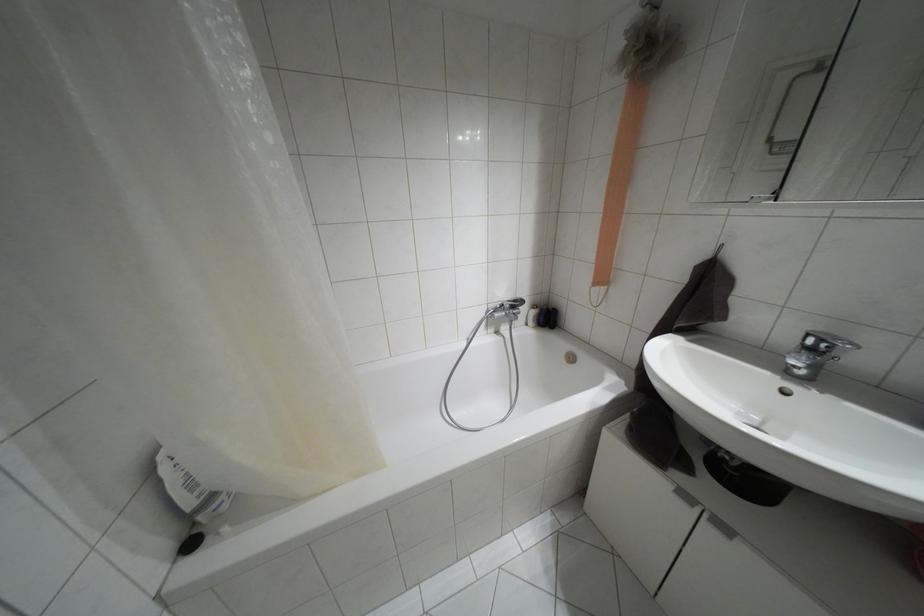
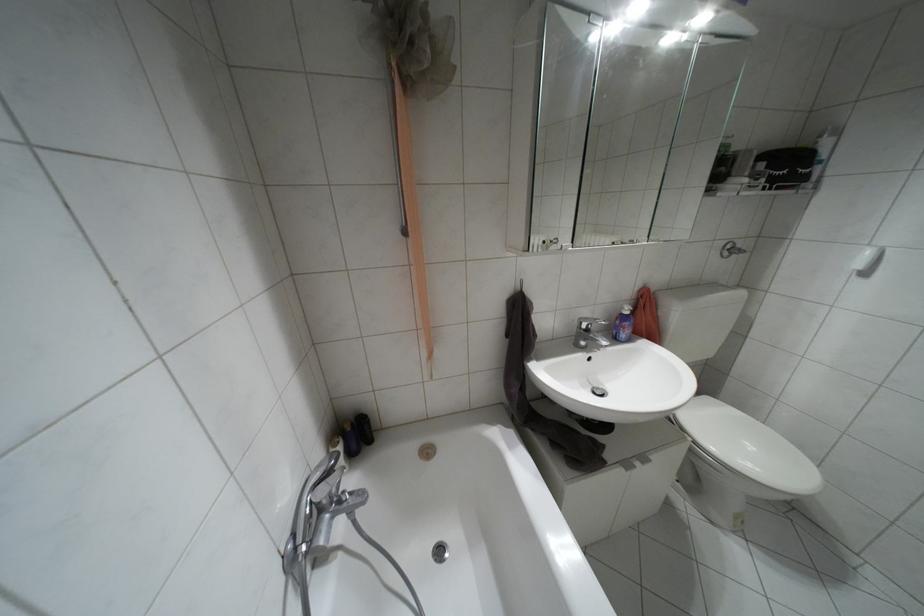
In the second image, find the point that corresponds to (x=811, y=350) in the first image.

(587, 330)